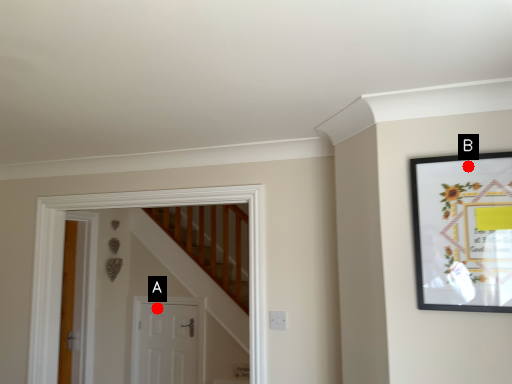
Question: Two points are circled on the image, labeled by A and B beside each circle. Which of the following is the farthest from the observer?

Choices:
 (A) A is further
 (B) B is further

Answer: (A)